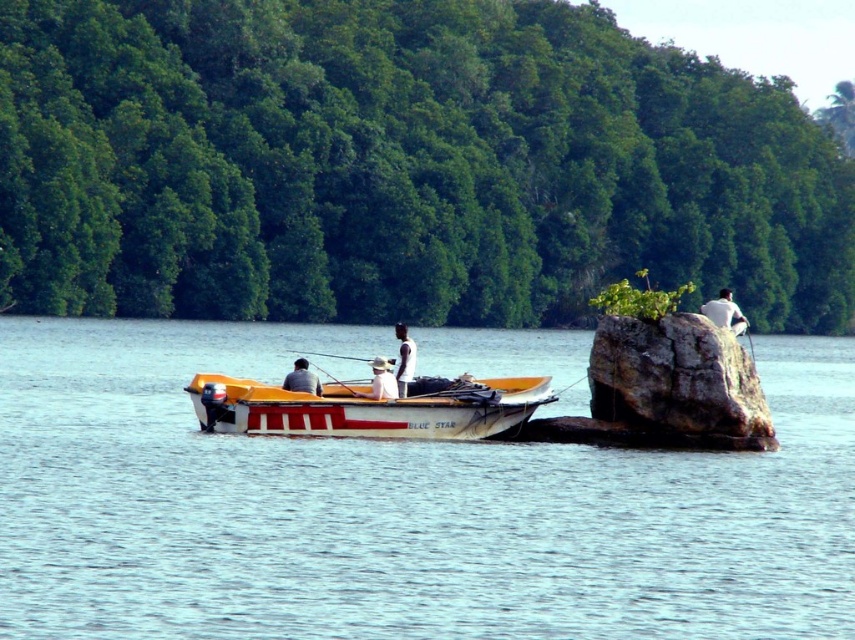
Question: Is the position of blue water at center less distant than that of light blue fabric shirt at center?

Choices:
 (A) no
 (B) yes

Answer: (B)

Question: Is white matte shirt at center smaller than light blue fabric shirt at center?

Choices:
 (A) yes
 (B) no

Answer: (B)

Question: Which point is closer to the camera?

Choices:
 (A) (410, 369)
 (B) (108, 390)
 (C) (715, 308)
 (D) (302, 412)

Answer: (D)

Question: Which object is the closest to the light blue fabric shirt at center?

Choices:
 (A) rocky gray at right
 (B) white matte shirt at center
 (C) white matte shirt at upper right
 (D) white matte hat at center

Answer: (D)

Question: Which object appears farthest from the camera in this image?

Choices:
 (A) white matte hat at center
 (B) white matte shirt at center

Answer: (B)

Question: Is white matte hat at center wider than light blue fabric shirt at center?

Choices:
 (A) yes
 (B) no

Answer: (A)